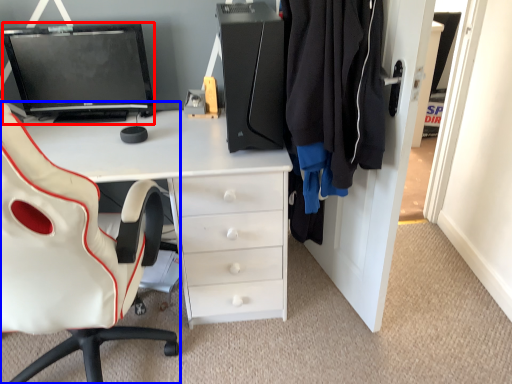
Question: Which of the following is the closest to the observer, computer monitor (highlighted by a red box) or chair (highlighted by a blue box)?

Choices:
 (A) computer monitor
 (B) chair

Answer: (B)